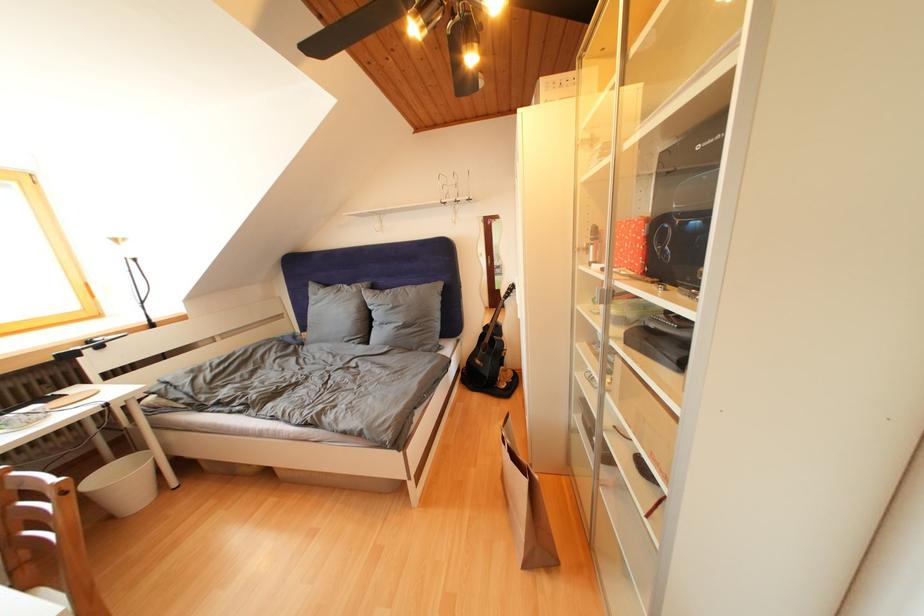
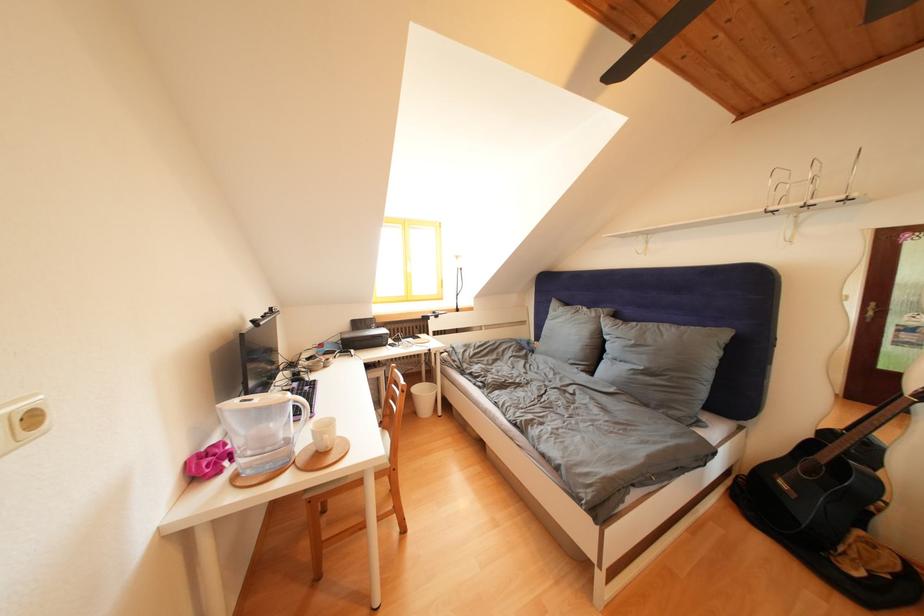
The point at (110, 469) is marked in the first image. Where is the corresponding point in the second image?

(429, 387)